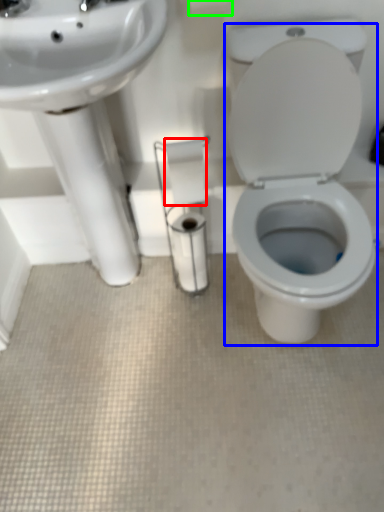
Question: Which is nearer to the toilet paper (highlighted by a red box)? porcelain (highlighted by a blue box) or toilet paper (highlighted by a green box).

Choices:
 (A) porcelain
 (B) toilet paper

Answer: (A)